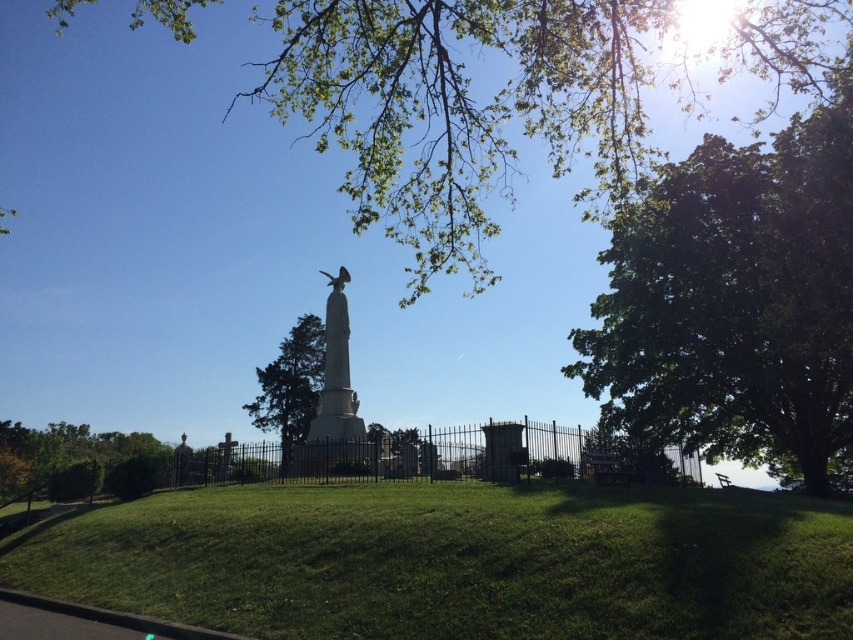
Is green leafy tree at upper right thinner than black wrought iron fence at center?

Correct, green leafy tree at upper right's width is less than black wrought iron fence at center's.

Describe the element at coordinates (735, 300) in the screenshot. I see `green leafy tree at upper right` at that location.

Is point (784, 451) closer to camera compared to point (183, 467)?

No, it is not.

The height and width of the screenshot is (640, 853). What are the coordinates of `green leafy tree at upper right` in the screenshot? It's located at (735, 300).

The width and height of the screenshot is (853, 640). What do you see at coordinates (505, 97) in the screenshot? I see `green leafy tree at upper center` at bounding box center [505, 97].

Is green leafy tree at upper center to the right of green leafy tree at lower left from the viewer's perspective?

Correct, you'll find green leafy tree at upper center to the right of green leafy tree at lower left.

What do you see at coordinates (505, 97) in the screenshot? I see `green leafy tree at upper center` at bounding box center [505, 97].

In order to click on green leafy tree at upper center in this screenshot , I will do `click(505, 97)`.

Is point (16, 456) closer to viewer compared to point (300, 388)?

That is True.

Who is taller, green leafy tree at lower left or green textured tree at center?

green textured tree at center is taller.

This screenshot has height=640, width=853. What do you see at coordinates (62, 451) in the screenshot?
I see `green leafy tree at lower left` at bounding box center [62, 451].

What are the coordinates of `green leafy tree at lower left` in the screenshot? It's located at (62, 451).